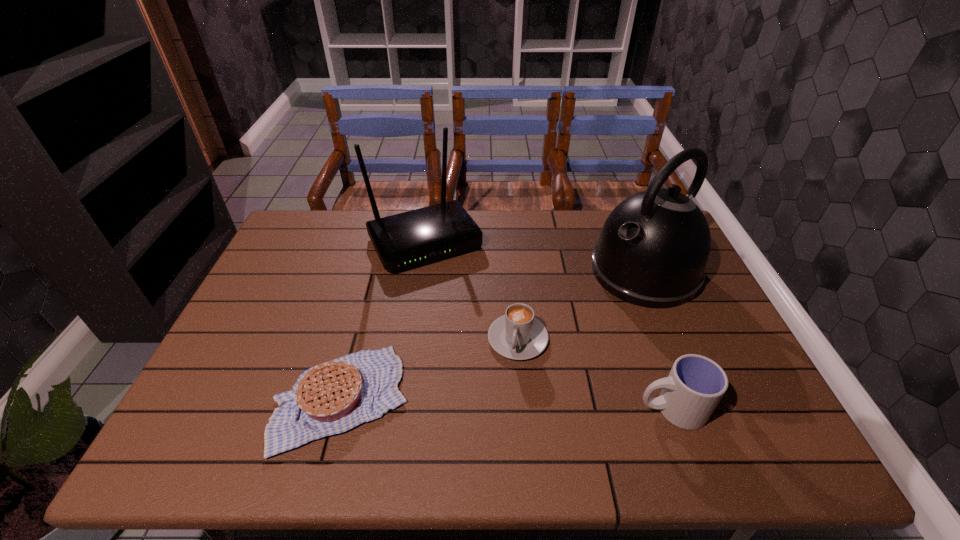
Where is `free region that satisfies the following two spatial constraints: 1. on the front side of the router; 2. on the right side of the tallest object`? This screenshot has width=960, height=540. free region that satisfies the following two spatial constraints: 1. on the front side of the router; 2. on the right side of the tallest object is located at coordinates 420,272.

Locate an element on the screen. Image resolution: width=960 pixels, height=540 pixels. vacant space that satisfies the following two spatial constraints: 1. on the front side of the cup; 2. with the handle on the side of the router is located at coordinates [399, 409].